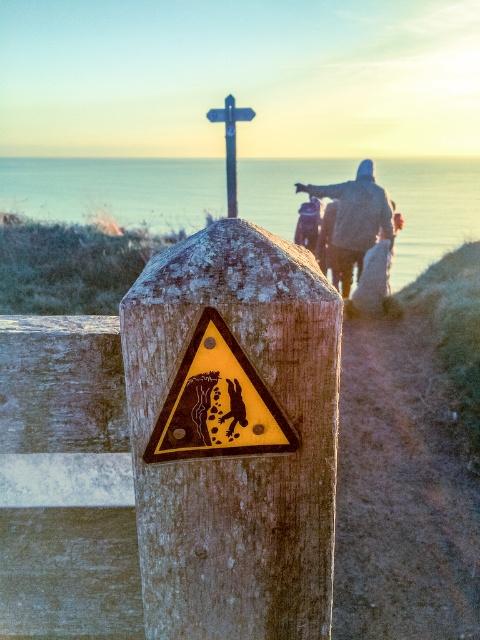
Question: Is yellow matte warning sign at center bigger than metallic blue signpost at upper center?

Choices:
 (A) yes
 (B) no

Answer: (B)

Question: Which object is farther from the camera taking this photo?

Choices:
 (A) yellow matte warning sign at center
 (B) gray woolen sweater at upper right
 (C) metallic blue signpost at upper center
 (D) weathered wood post at center

Answer: (B)

Question: Which object is closer to the camera taking this photo?

Choices:
 (A) metallic blue signpost at upper center
 (B) weathered wood post at center
 (C) gray woolen sweater at upper right
 (D) yellow matte warning sign at center

Answer: (B)

Question: Can you confirm if weathered wood post at center is positioned to the right of metallic blue signpost at upper center?

Choices:
 (A) yes
 (B) no

Answer: (A)

Question: Which point is closer to the camera taking this photo?

Choices:
 (A) (236, 209)
 (B) (383, 209)
 (C) (211, 508)

Answer: (C)

Question: Is yellow matte warning sign at center wider than metallic blue signpost at upper center?

Choices:
 (A) yes
 (B) no

Answer: (B)